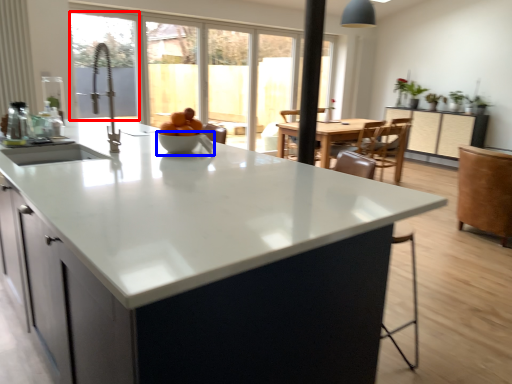
Question: Which object appears farthest to the camera in this image, window screen (highlighted by a red box) or bowl (highlighted by a blue box)?

Choices:
 (A) window screen
 (B) bowl

Answer: (B)